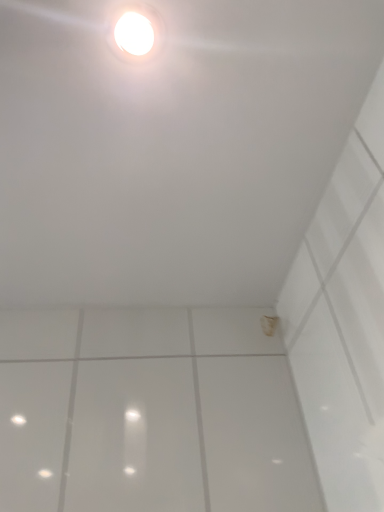
What do you see at coordinates (135, 33) in the screenshot? The width and height of the screenshot is (384, 512). I see `white glossy light fixture at upper center` at bounding box center [135, 33].

Image resolution: width=384 pixels, height=512 pixels. I want to click on white glossy light fixture at upper center, so click(x=135, y=33).

Where is `white glossy light fixture at upper center`? This screenshot has height=512, width=384. white glossy light fixture at upper center is located at coordinates (135, 33).